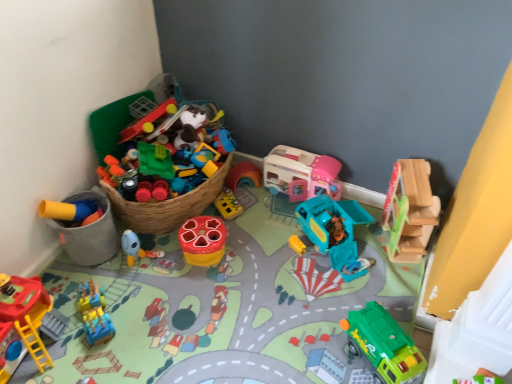
This screenshot has height=384, width=512. Identify the location of free space that is in between teal plastic truck at center, which ranks as the third toy in right-to-left order, and blue rubber duck at center, which ranks as the sixth toy in right-to-left order. (238, 252).